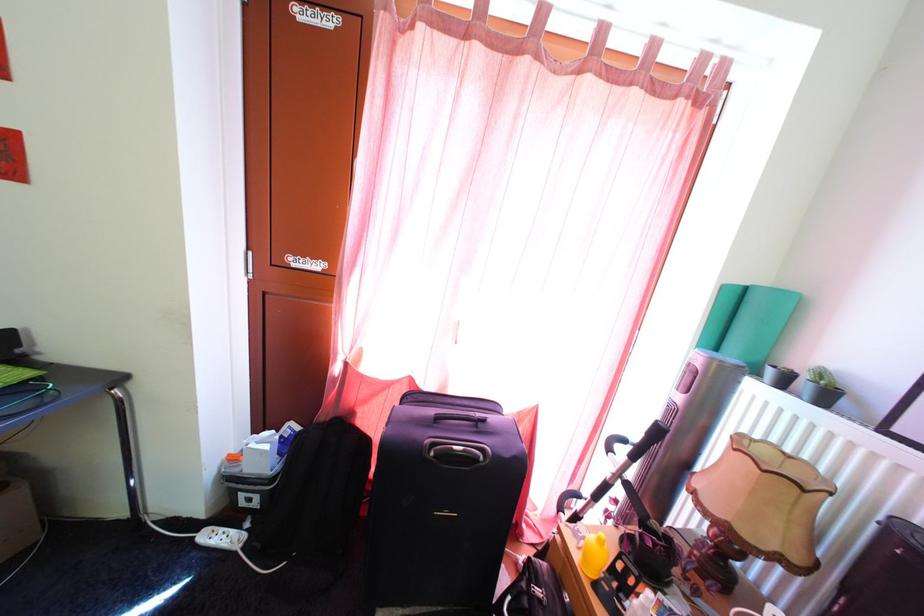
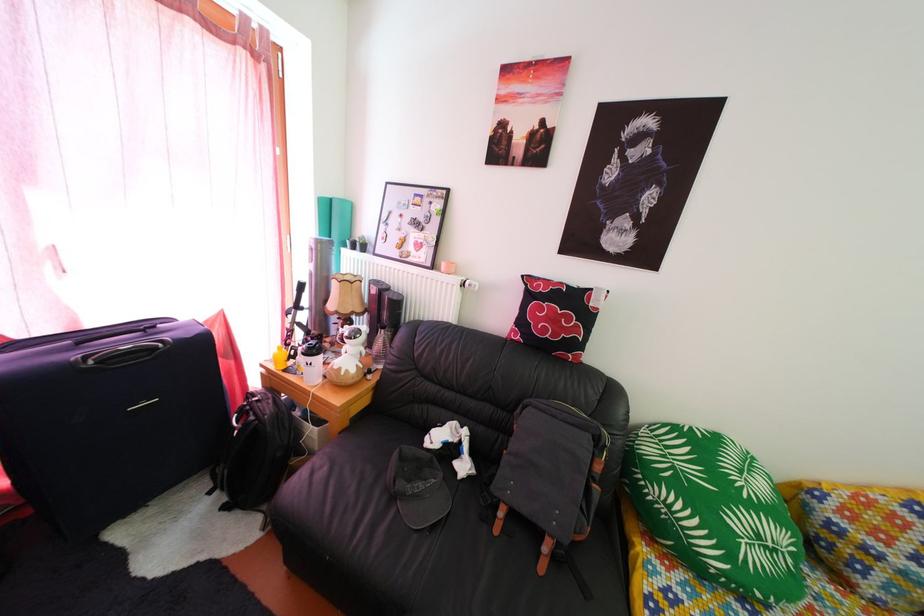
Where in the second image is the point corresponding to pixel 756 297 from the first image?

(339, 208)